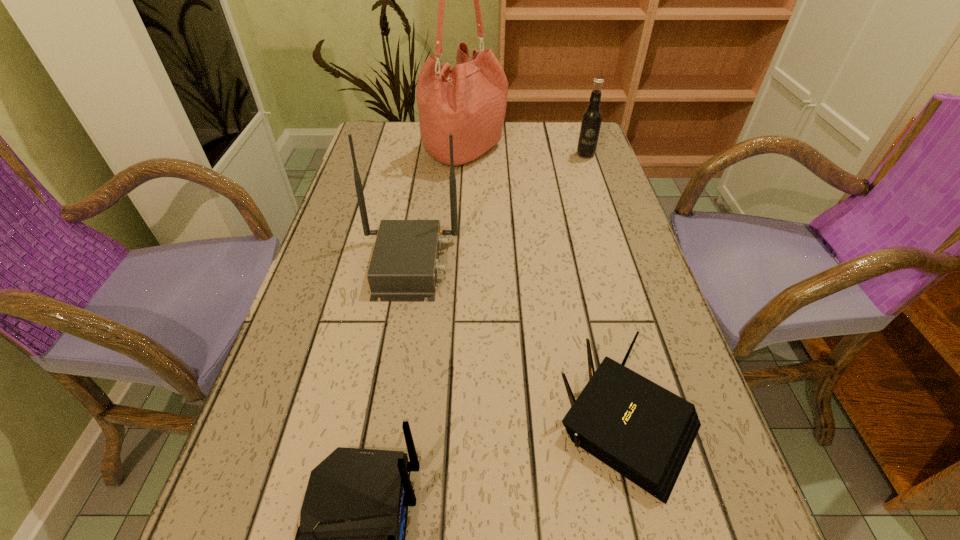
In order to click on blank region between the root beer and the shortest router in this screenshot , I will do point(607,289).

Where is `vacant area that lies between the farthest router and the handbag`? This screenshot has width=960, height=540. vacant area that lies between the farthest router and the handbag is located at coordinates (437, 207).

Identify the location of free space between the rightmost router and the third nearest object. (518, 343).

Where is `vacant space that is in between the shortest router and the root beer`? vacant space that is in between the shortest router and the root beer is located at coordinates (607, 289).

Locate an element on the screen. Image resolution: width=960 pixels, height=540 pixels. free space between the tallest object and the shortest router is located at coordinates (546, 287).

You are a GUI agent. You are given a task and a screenshot of the screen. Output one action in this format:
    pyautogui.click(x=<x>, y=<y>)
    Task: Click on the vacant space that's between the tallest object and the tallest router
    Image resolution: width=960 pixels, height=540 pixels.
    Given the screenshot: What is the action you would take?
    pyautogui.click(x=437, y=207)

You are a GUI agent. You are given a task and a screenshot of the screen. Output one action in this format:
    pyautogui.click(x=<x>, y=<y>)
    Task: Click on the empty space that is in between the rightmost router and the root beer
    The width and height of the screenshot is (960, 540).
    Given the screenshot: What is the action you would take?
    pyautogui.click(x=607, y=289)

Identify the location of the second closest object to the shortest object. (404, 266).

The height and width of the screenshot is (540, 960). I want to click on the second closest object to the tallest object, so click(x=404, y=266).

Locate an element on the screen. The image size is (960, 540). router that is the second closest to the farthest router is located at coordinates (351, 539).